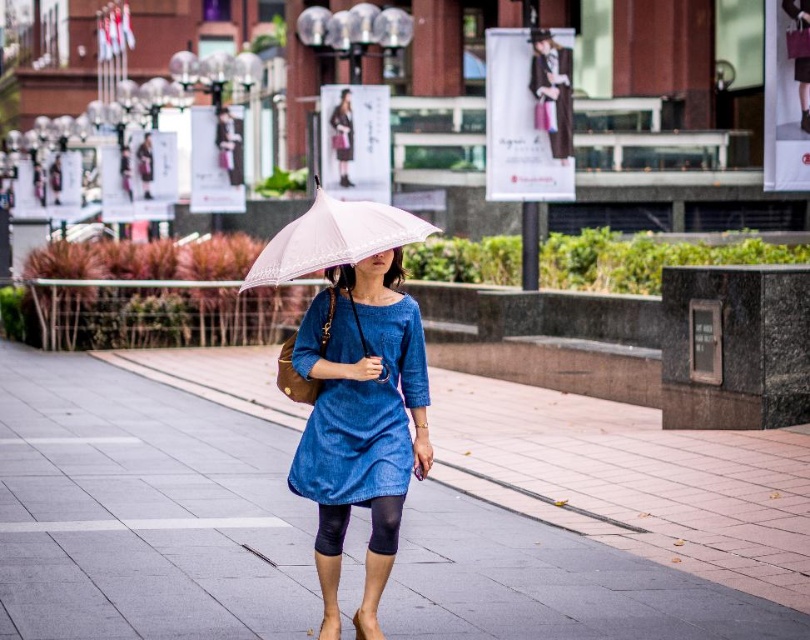
Find the location of `denim dress at center`. denim dress at center is located at coordinates (365, 417).

Does denim dress at center lie in front of black matte leggings at center?

No, denim dress at center is further to the viewer.

Which is in front, point (313, 465) or point (382, 531)?

Point (382, 531) is more forward.

Identify the location of denim dress at center. (365, 417).

Can you confirm if smooth concrete pavement at center is positioned above white lace umbrella at center?

No.

Does point (39, 440) come behind point (407, 241)?

That is True.

This screenshot has height=640, width=810. Identify the location of smooth concrete pavement at center. (141, 512).

Is smooth concrete pavement at center shorter than denim dress at center?

Yes, smooth concrete pavement at center is shorter than denim dress at center.

Does point (265, 522) come farther from viewer compared to point (380, 440)?

Yes, point (265, 522) is farther from viewer.

I want to click on smooth concrete pavement at center, so click(x=141, y=512).